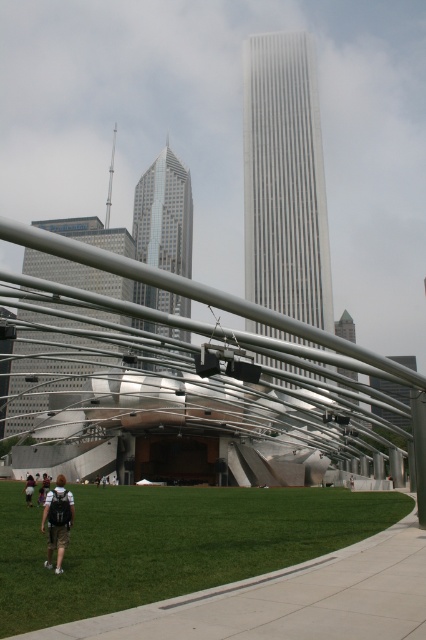
Identify the location of green grass at lower left. The height and width of the screenshot is (640, 426). (169, 544).

Does point (219, 547) lie behind point (112, 346)?

That is False.

Is point (112, 557) positioned in front of point (23, 250)?

Yes, it is.

Identify the location of green grass at lower left. (169, 544).

This screenshot has height=640, width=426. What do you see at coordinates (169, 544) in the screenshot?
I see `green grass at lower left` at bounding box center [169, 544].

Measure the distance between green grass at lower left and camera.

8.23 meters

I want to click on green grass at lower left, so click(x=169, y=544).

Is green grass at lower left above dark gray backpack at lower left?

Yes.

Consider the image. Does green grass at lower left appear on the right side of dark gray backpack at lower left?

Indeed, green grass at lower left is positioned on the right side of dark gray backpack at lower left.

At what (x,y) coordinates should I click in order to perform the action: click on green grass at lower left. Please return your answer as a coordinate pair (x, y). The image size is (426, 640). Looking at the image, I should click on (169, 544).